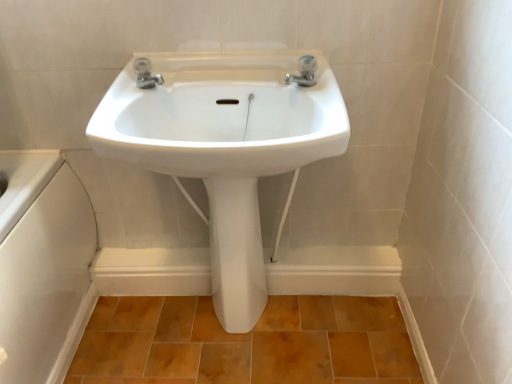
The width and height of the screenshot is (512, 384). I want to click on vacant area located to the right-hand side of satin nickel faucet at upper center, acting as the first tap starting from the left, so click(210, 73).